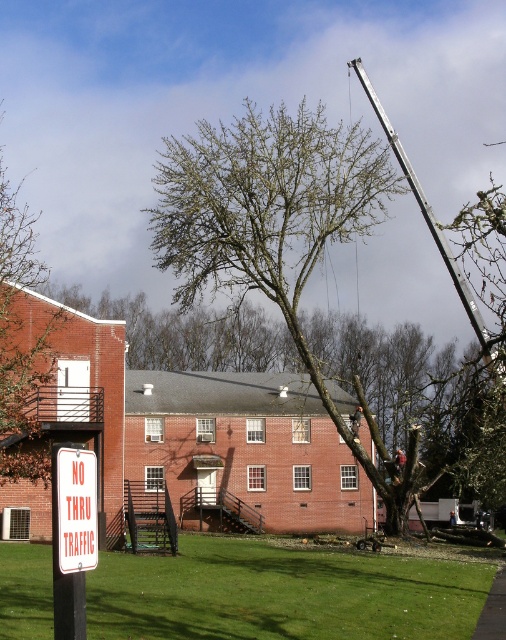
Who is lower down, bare branches at center or white plastic sign at lower left?

Positioned lower is white plastic sign at lower left.

Is point (268, 264) positioned in front of point (76, 531)?

No, (268, 264) is behind (76, 531).

Which is in front, point (202, 289) or point (94, 525)?

Positioned in front is point (94, 525).

The height and width of the screenshot is (640, 506). In order to click on bare branches at center in this screenshot , I will do `click(278, 232)`.

Is point (429, 634) positioned before point (66, 564)?

No, (429, 634) is behind (66, 564).

Who is shorter, green grass at lower center or white plastic sign at lower left?

white plastic sign at lower left is shorter.

Who is more distant from viewer, (200, 548) or (69, 449)?

The point (200, 548) is behind.

The height and width of the screenshot is (640, 506). I want to click on green grass at lower center, so click(x=281, y=593).

Between bare branches at center and green grass at lower center, which one appears on the right side from the viewer's perspective?

From the viewer's perspective, bare branches at center appears more on the right side.

You are a GUI agent. You are given a task and a screenshot of the screen. Output one action in this format:
    pyautogui.click(x=<x>, y=<y>)
    Task: Click on the bare branches at center
    
    Given the screenshot: What is the action you would take?
    pyautogui.click(x=278, y=232)